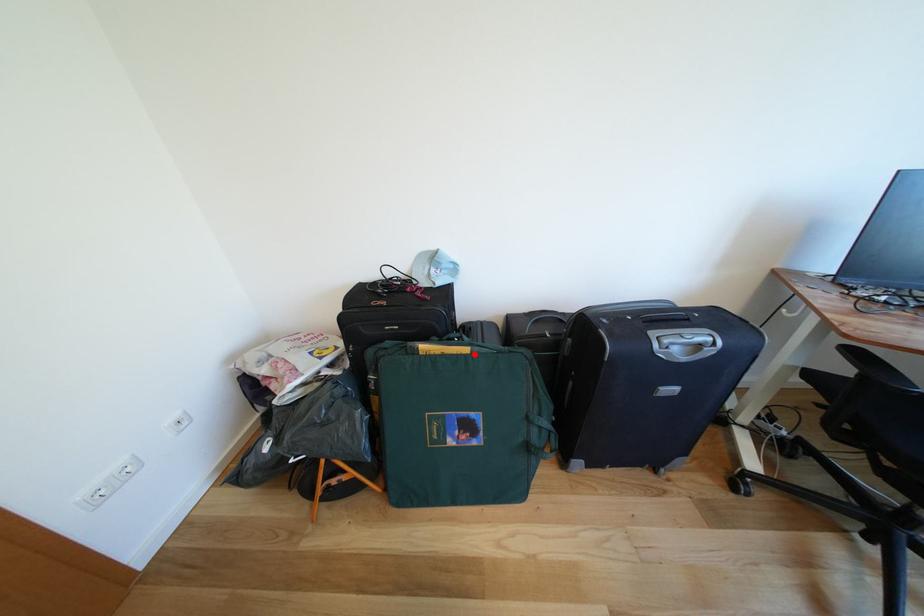
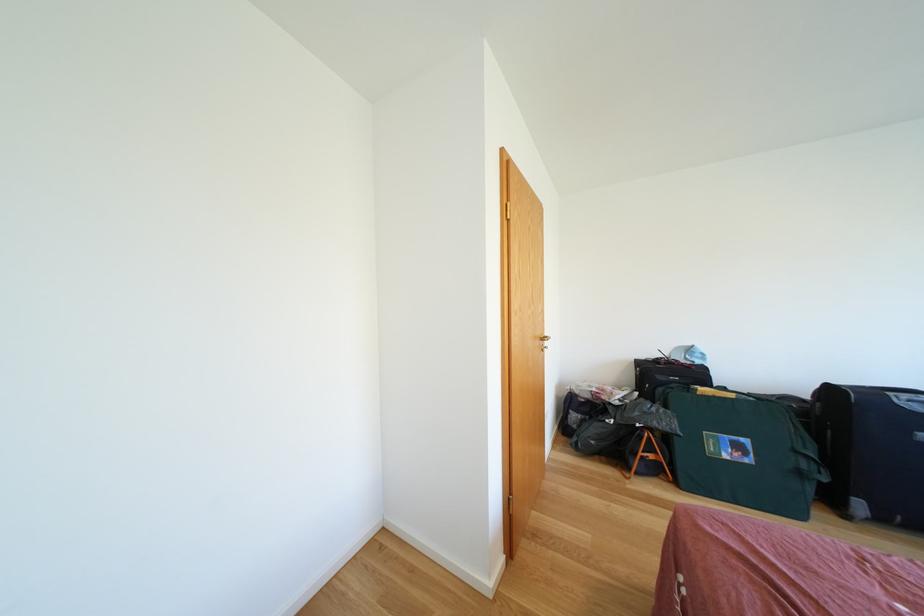
Locate, in the second image, the point that corresponds to the highlighted location in the first image.

(739, 400)